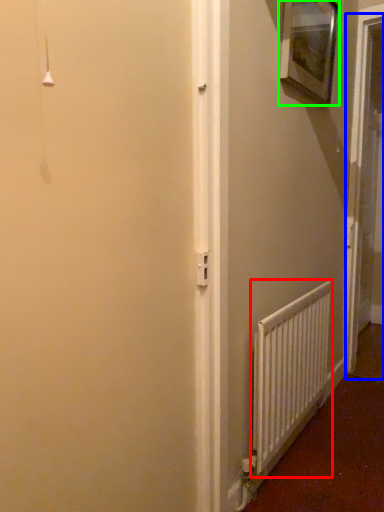
Question: Which object is positioned farthest from radiator (highlighted by a red box)? Select from screen door (highlighted by a blue box) and picture frame (highlighted by a green box).

Choices:
 (A) screen door
 (B) picture frame

Answer: (B)